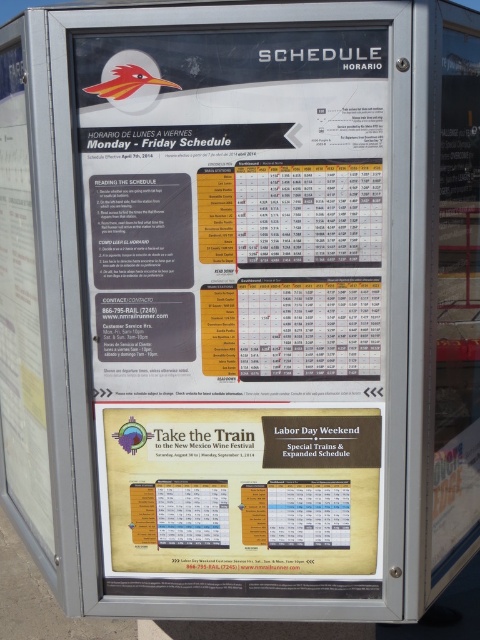
Question: Does white paper schedule at center appear on the left side of yellow paper-like labor day weekend poster at center?

Choices:
 (A) yes
 (B) no

Answer: (A)

Question: Does white paper schedule at center have a lesser width compared to yellow paper-like labor day weekend poster at center?

Choices:
 (A) yes
 (B) no

Answer: (B)

Question: Is white paper schedule at center below yellow paper-like labor day weekend poster at center?

Choices:
 (A) no
 (B) yes

Answer: (A)

Question: Among these points, which one is nearest to the camera?

Choices:
 (A) (197, 513)
 (B) (195, 477)

Answer: (B)